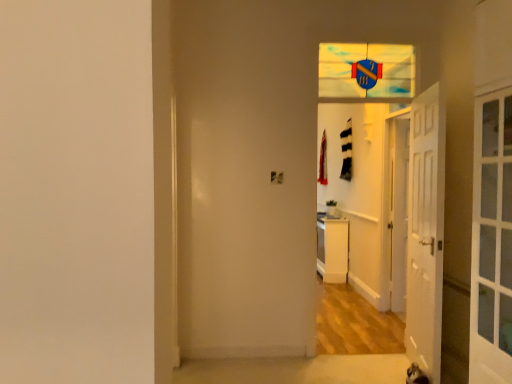
Question: Should I look upward or downward to see white glossy door at center, marked as the second door in a left-to-right arrangement?

Choices:
 (A) down
 (B) up

Answer: (A)

Question: Would you say stained glass shield at upper center is outside white glossy dresser at center?

Choices:
 (A) no
 (B) yes

Answer: (B)

Question: Does stained glass shield at upper center have a smaller size compared to white glossy dresser at center?

Choices:
 (A) yes
 (B) no

Answer: (A)

Question: From a real-world perspective, is stained glass shield at upper center over white glossy dresser at center?

Choices:
 (A) yes
 (B) no

Answer: (A)

Question: Considering the relative sizes of stained glass shield at upper center and white glossy dresser at center in the image provided, is stained glass shield at upper center bigger than white glossy dresser at center?

Choices:
 (A) yes
 (B) no

Answer: (B)

Question: From a real-world perspective, is stained glass shield at upper center positioned under white glossy dresser at center based on gravity?

Choices:
 (A) yes
 (B) no

Answer: (B)

Question: Could you tell me if stained glass shield at upper center is facing white glossy dresser at center?

Choices:
 (A) yes
 (B) no

Answer: (B)

Question: Does white glossy door at center, which is counted as the first door, starting from the right, have a greater height compared to white wooden door at right, acting as the 1th door starting from the left?

Choices:
 (A) yes
 (B) no

Answer: (B)

Question: Is white glossy door at center, marked as the second door in a front-to-back arrangement, to the right of white wooden door at right, which is the first door from front to back, from the viewer's perspective?

Choices:
 (A) yes
 (B) no

Answer: (A)

Question: From the image's perspective, would you say white glossy door at center, the 1th door in the back-to-front sequence, is shown under white wooden door at right, placed as the second door when sorted from back to front?

Choices:
 (A) yes
 (B) no

Answer: (B)

Question: Does white glossy door at center, which is counted as the first door, starting from the right, appear on the left side of white wooden door at right, which is the first door from front to back?

Choices:
 (A) yes
 (B) no

Answer: (B)

Question: Could you tell me if white glossy door at center, marked as the second door in a front-to-back arrangement, is facing white wooden door at right, acting as the 1th door starting from the left?

Choices:
 (A) yes
 (B) no

Answer: (B)

Question: Is white glossy door at center, marked as the second door in a left-to-right arrangement, not inside white wooden door at right, which is the first door from front to back?

Choices:
 (A) yes
 (B) no

Answer: (A)

Question: Does stained glass shield at upper center turn towards white glossy door at center, marked as the second door in a front-to-back arrangement?

Choices:
 (A) yes
 (B) no

Answer: (B)